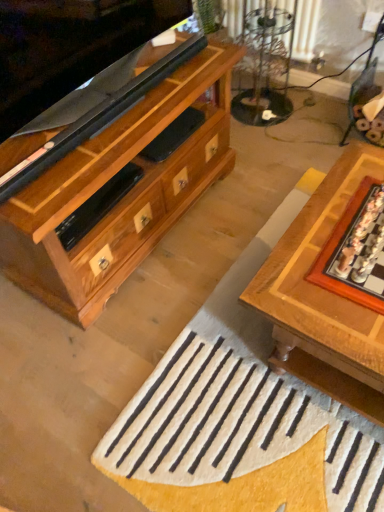
Question: From a real-world perspective, is white woolen doormat at center positioned above or below wooden board game at right?

Choices:
 (A) below
 (B) above

Answer: (A)

Question: Is white woolen doormat at center taller or shorter than wooden board game at right?

Choices:
 (A) short
 (B) tall

Answer: (B)

Question: Based on their relative distances, which object is farther from the wooden chessboard at center?

Choices:
 (A) clear glass table at upper center
 (B) wooden board game at right
 (C) white woolen doormat at center

Answer: (A)

Question: Estimate the real-world distances between objects in this image. Which object is farther from the clear glass table at upper center?

Choices:
 (A) wooden board game at right
 (B) white woolen doormat at center
 (C) wooden chessboard at center

Answer: (B)